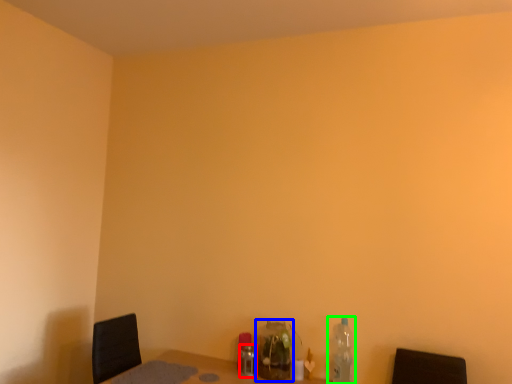
Question: Estimate the real-world distances between objects in this image. Which object is farther from bottle (highlighted by a red box), bottle (highlighted by a blue box) or bottle (highlighted by a green box)?

Choices:
 (A) bottle
 (B) bottle

Answer: (B)